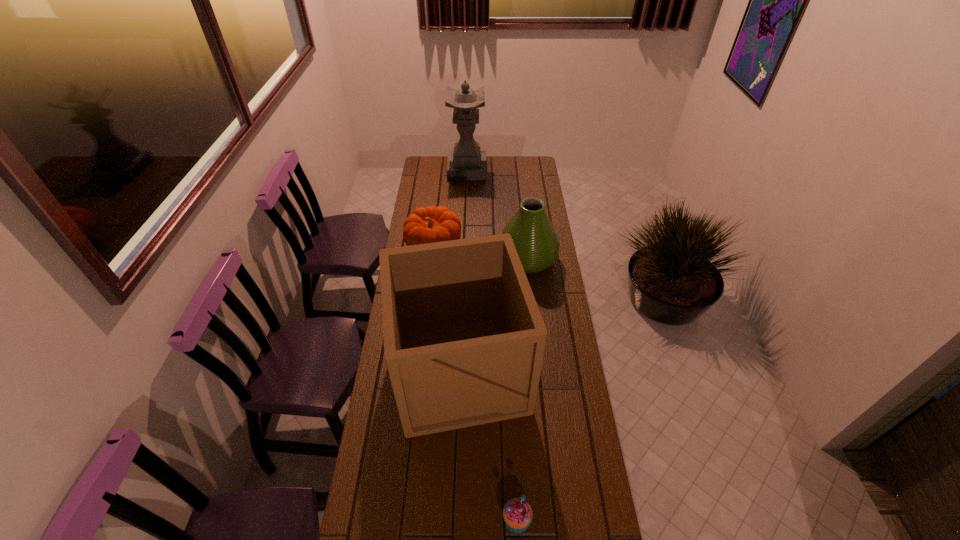
The width and height of the screenshot is (960, 540). Identify the location of sculpture. (466, 162).

Where is `the farthest object`? the farthest object is located at coordinates (466, 162).

This screenshot has width=960, height=540. I want to click on the fourth shortest object, so click(464, 340).

The width and height of the screenshot is (960, 540). Find the location of `box`. box is located at coordinates (464, 340).

Find the location of a particular element. This screenshot has width=960, height=540. vase is located at coordinates (534, 236).

Where is `the fourth tallest object`? This screenshot has height=540, width=960. the fourth tallest object is located at coordinates (431, 224).

Locate an element on the screen. This screenshot has height=540, width=960. the nearest object is located at coordinates (517, 513).

In order to click on muffin in this screenshot , I will do `click(517, 513)`.

This screenshot has width=960, height=540. What are the coordinates of `vacant space located 0.260m at the front opening of the farthest object` in the screenshot? It's located at (530, 170).

Identify the location of free space located 0.220m on the back of the fourth shortest object. This screenshot has height=540, width=960. (464, 279).